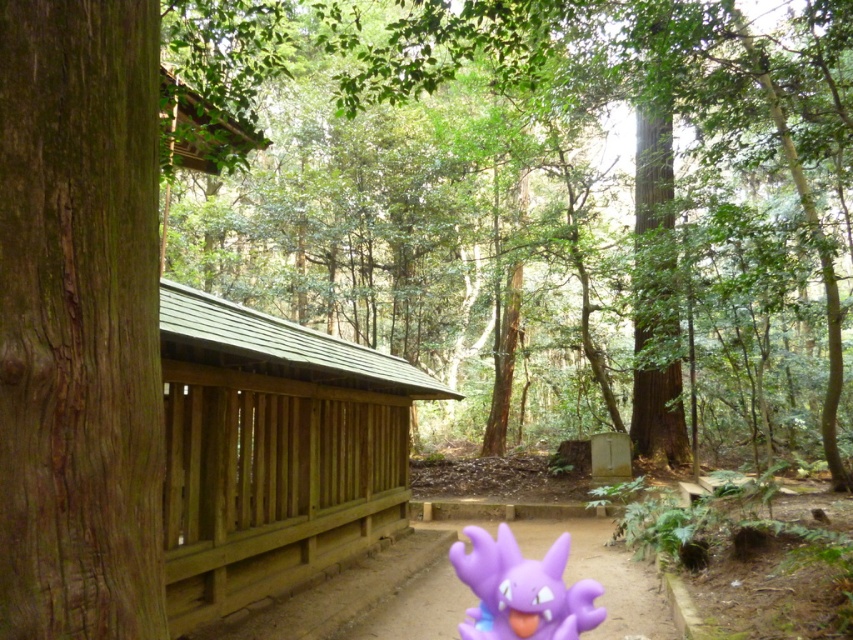
You are standing on the dirt path in the forest and see the brown wooden fence at left. If you walk straight ahead along the path, will you eventually see the traditional wooden structure mentioned in the scene description?

The traditional wooden structure is partially visible on the left side in the scene, and the dirt path leads through the forest. Since the path is in the foreground and the structure is on the left, walking straight ahead along the path may keep the structure in view or lead further away depending on the path direction. However, the scene does not specify the path direction relative to the structure. Therefore, it cannot be determined with certainty from the given information.

You are standing on the dirt path in the forest and looking towards the traditional wooden structure on the left. There are two points marked on your map at coordinates point (817, 252) and point (480, 573). Which point is closer to you?

Point (817, 252) is further to the viewer than point (480, 573), so the closer point to you is point (480, 573).